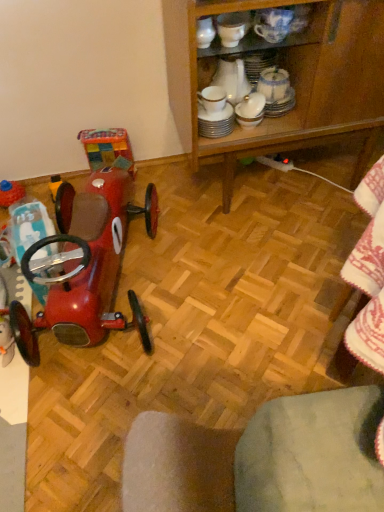
Question: Is wooden cabinet at center wider or thinner than shiny red car at left, arranged as the 2th toy when viewed from the back?

Choices:
 (A) wide
 (B) thin

Answer: (B)

Question: Does point (372, 89) appear closer or farther from the camera than point (99, 237)?

Choices:
 (A) closer
 (B) farther

Answer: (B)

Question: Based on their relative distances, which object is nearer to the shiny red car at left, which is the first toy from front to back?

Choices:
 (A) shiny red car at left, the second toy viewed from the front
 (B) wooden cabinet at center

Answer: (A)

Question: Which is farther from the wooden cabinet at center?

Choices:
 (A) shiny red car at left, which is the 1th toy in right-to-left order
 (B) shiny red car at left, the second toy viewed from the front

Answer: (B)